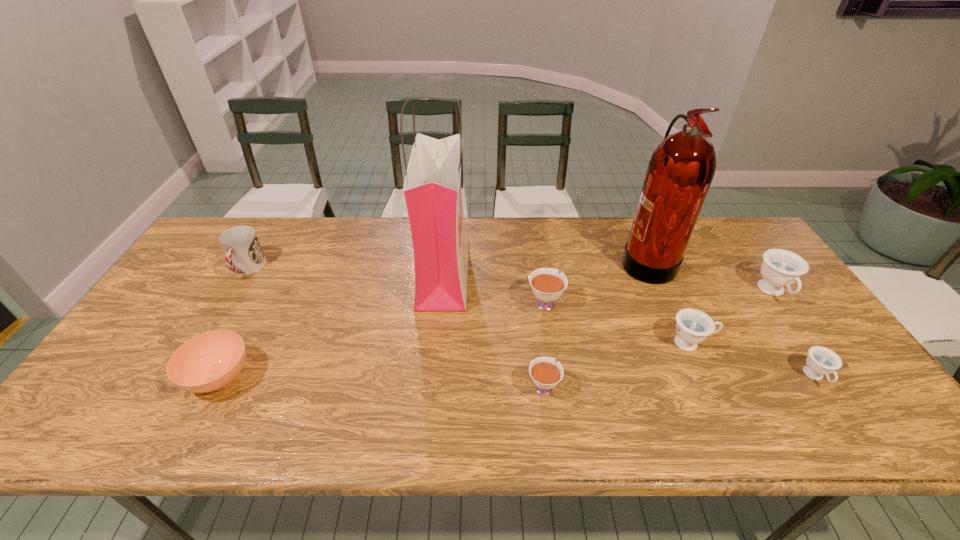
The height and width of the screenshot is (540, 960). I want to click on vacant area situated 0.250m on the side of the third teacup from right to left with the handle, so pos(811,343).

Locate an element on the screen. This screenshot has width=960, height=540. vacant space located 0.170m on the right of the soup bowl is located at coordinates (324, 377).

Find the location of `free space located on the side of the smaller white teacup with the handle`. free space located on the side of the smaller white teacup with the handle is located at coordinates (539, 350).

The height and width of the screenshot is (540, 960). Identify the location of vacant space located 0.140m on the side of the smaller white teacup with the handle. [536, 327].

Locate an element on the screen. vacant space located on the side of the smaller white teacup with the handle is located at coordinates (534, 310).

The width and height of the screenshot is (960, 540). Find the location of `free space located 0.050m on the side of the nearest blue teacup with the handle`. free space located 0.050m on the side of the nearest blue teacup with the handle is located at coordinates (839, 412).

At what (x,y) coordinates should I click in order to perform the action: click on fire extinguisher present at the far edge. Please return your answer as a coordinate pair (x, y). This screenshot has width=960, height=540. Looking at the image, I should click on (680, 171).

This screenshot has width=960, height=540. Identify the location of shopping bag that is at the far edge. (432, 189).

I want to click on cup that is at the far edge, so click(244, 255).

I want to click on object positioned at the near edge, so 209,361.